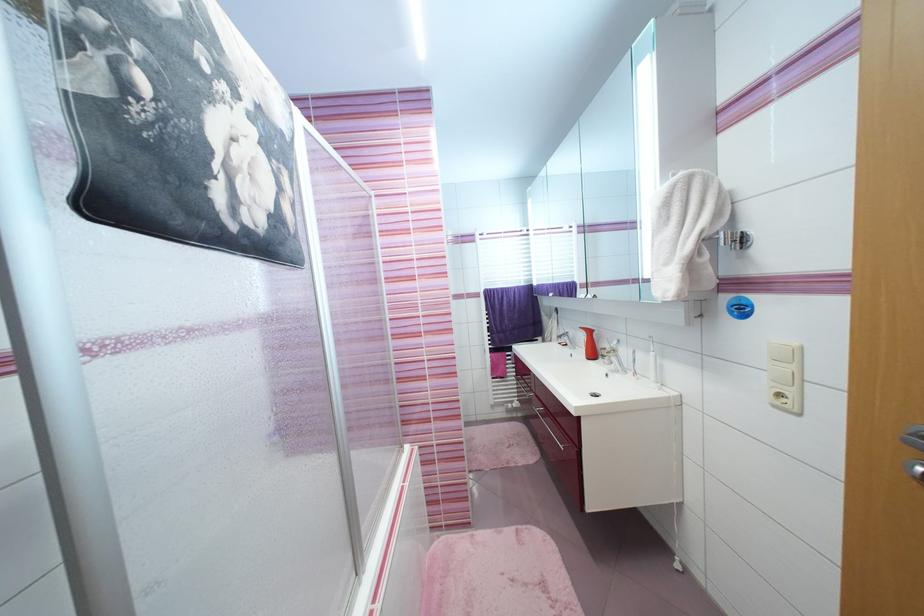
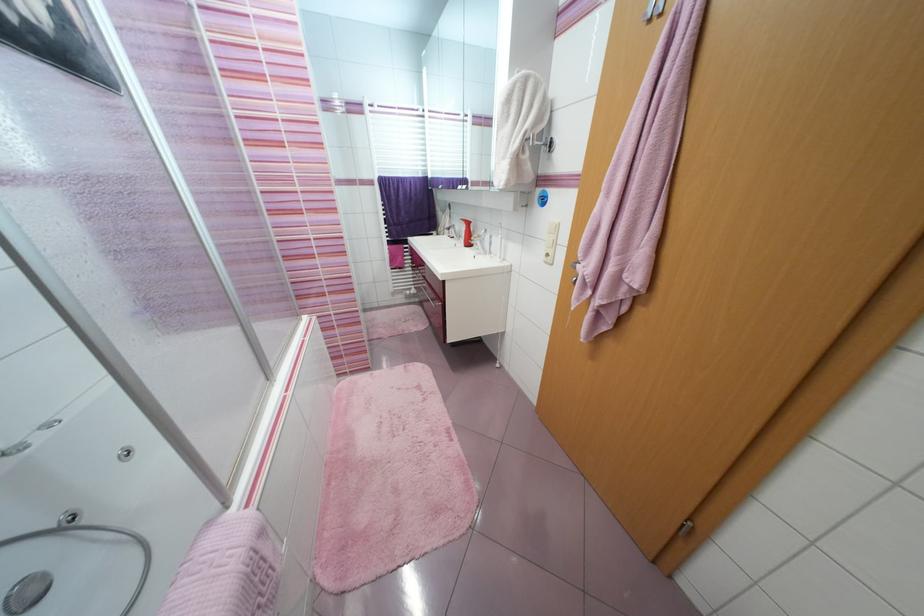
The point at (618, 360) is marked in the first image. Where is the corresponding point in the second image?

(483, 244)